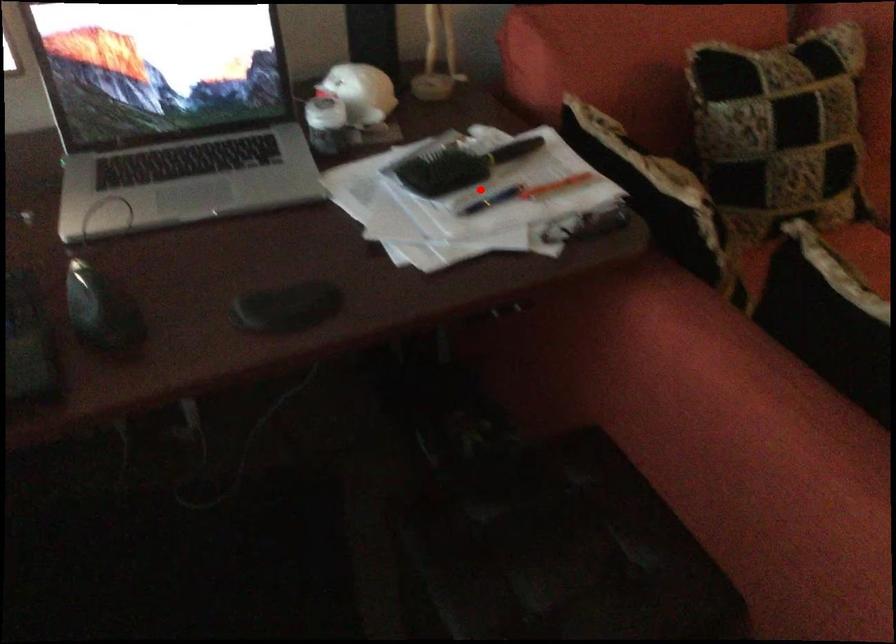
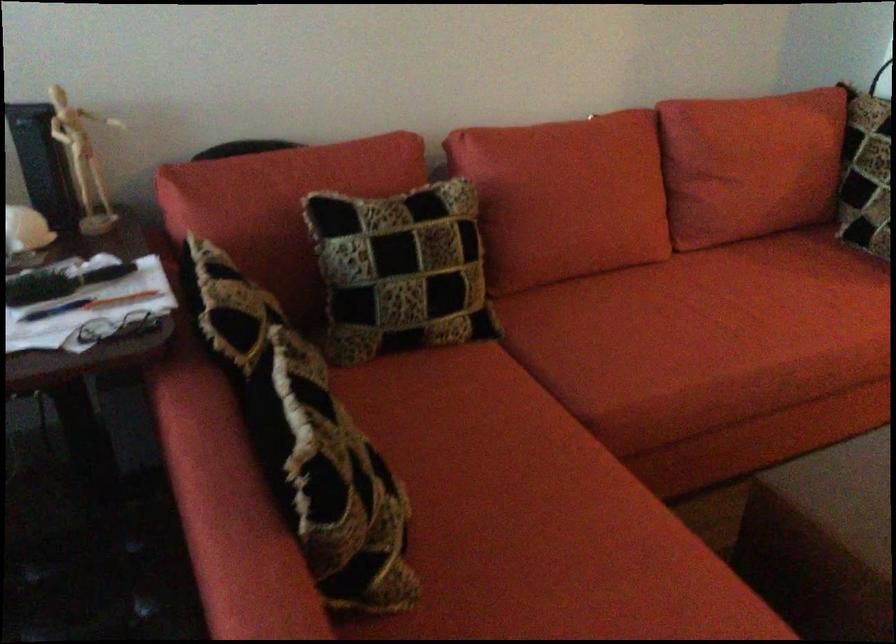
Question: I am providing you with two images of the same scene from different viewpoints. A red point is marked on the first image. Can you still see the location of the red point in image 2?

Choices:
 (A) Yes
 (B) No

Answer: (A)